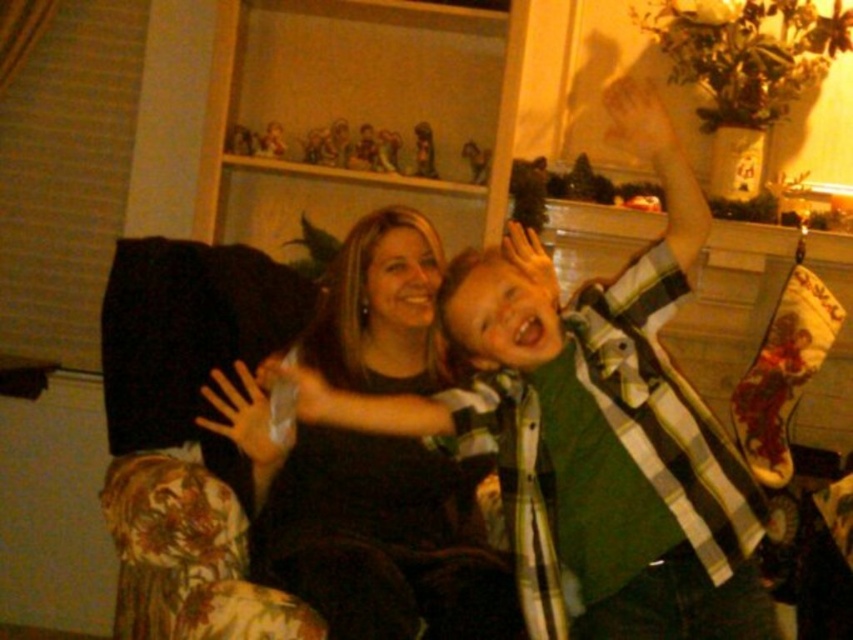
Is green plaid shirt at center closer to camera compared to black matte shirt at center?

Yes, green plaid shirt at center is closer to the viewer.

Consider the image. Can you confirm if green plaid shirt at center is shorter than black matte shirt at center?

In fact, green plaid shirt at center may be taller than black matte shirt at center.

Between point (383, 413) and point (518, 628), which one is positioned in front?

Point (383, 413) is more forward.

What are the coordinates of `green plaid shirt at center` in the screenshot? It's located at [x=592, y=428].